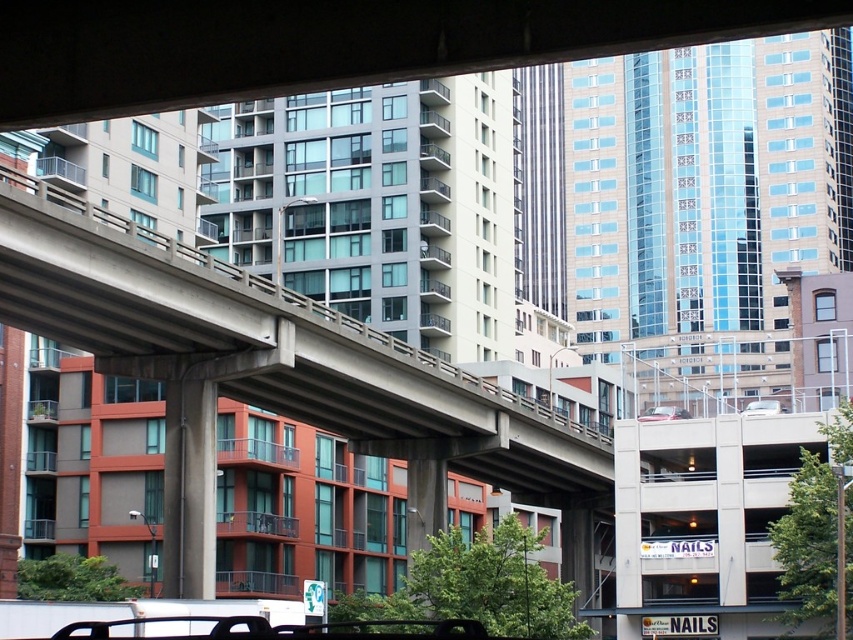
Looking at this image, you are standing under the overpass and looking at the scene. There is a point at coordinates point (273, 349). What material is located at that point?

The point (273, 349) indicates concrete at center.

You are driving a metallic silver sedan at center and want to park it under the overpass. There is a concrete at center blocking the path. Can you move the sedan to the right to avoid it?

The concrete at center is to the left of the metallic silver sedan at center, so moving the sedan to the right would allow it to avoid the concrete at center and park under the overpass.